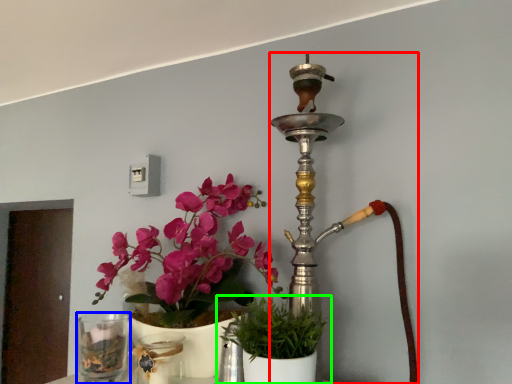
Question: Based on their relative distances, which object is farther from candle holder (highlighted by a red box)? Choose from vase (highlighted by a blue box) and houseplant (highlighted by a green box).

Choices:
 (A) vase
 (B) houseplant

Answer: (A)